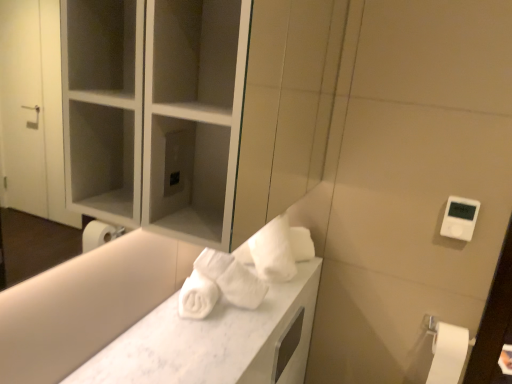
What is the approximate width of white matte toilet paper at lower right?

5.99 inches.

This screenshot has height=384, width=512. Find the location of `white matte toilet paper at lower right`. white matte toilet paper at lower right is located at coordinates (448, 354).

Describe the element at coordinates (448, 354) in the screenshot. This screenshot has width=512, height=384. I see `white matte toilet paper at lower right` at that location.

What do you see at coordinates (216, 341) in the screenshot?
I see `white marble counter top at center` at bounding box center [216, 341].

Image resolution: width=512 pixels, height=384 pixels. Identify the location of white marble counter top at center. (216, 341).

This screenshot has height=384, width=512. I want to click on white matte toilet paper at lower right, so click(448, 354).

Considering the positions of objects white matte toilet paper at lower right and white marble counter top at center in the image provided, who is more to the left, white matte toilet paper at lower right or white marble counter top at center?

white marble counter top at center is more to the left.

Which object is further away from the camera, white matte toilet paper at lower right or white marble counter top at center?

Positioned behind is white matte toilet paper at lower right.

Between point (449, 380) and point (238, 324), which one is positioned in front?

Positioned in front is point (238, 324).

From the picture: From the image's perspective, is white matte toilet paper at lower right above or below white marble counter top at center?

Clearly, from the image's perspective, white matte toilet paper at lower right is below white marble counter top at center.

From a real-world perspective, is white matte toilet paper at lower right over white marble counter top at center?

No, from a real-world perspective, white matte toilet paper at lower right is not over white marble counter top at center

Is white matte toilet paper at lower right wider than white marble counter top at center?

No, white matte toilet paper at lower right is not wider than white marble counter top at center.

From their relative heights in the image, would you say white matte toilet paper at lower right is taller or shorter than white marble counter top at center?

Considering their sizes, white matte toilet paper at lower right has more height than white marble counter top at center.

Considering the sizes of objects white matte toilet paper at lower right and white marble counter top at center in the image provided, who is smaller, white matte toilet paper at lower right or white marble counter top at center?

Smaller between the two is white matte toilet paper at lower right.

Would you say white matte toilet paper at lower right contains white marble counter top at center?

No.

Is white matte toilet paper at lower right far from white marble counter top at center?

No, there isn't a large distance between white matte toilet paper at lower right and white marble counter top at center.

Does white matte toilet paper at lower right turn towards white marble counter top at center?

No.

Can you tell me how much white matte toilet paper at lower right and white marble counter top at center differ in facing direction?

They differ by 89.4 degrees in their facing directions.

Measure the distance between white matte toilet paper at lower right and white marble counter top at center.

white matte toilet paper at lower right is 62.23 centimeters from white marble counter top at center.

Locate an element on the screen. toilet paper behind the white marble counter top at center is located at coordinates (448, 354).

Which object is positioned more to the right, white marble counter top at center or white matte toilet paper at lower right?

white matte toilet paper at lower right is more to the right.

Which is in front, white marble counter top at center or white matte toilet paper at lower right?

white marble counter top at center is more forward.

Is point (275, 335) closer or farther from the camera than point (435, 346)?

Point (275, 335) appears to be closer to the viewer than point (435, 346).

From the image's perspective, is white marble counter top at center below white matte toilet paper at lower right?

Incorrect, from the image's perspective, white marble counter top at center is higher than white matte toilet paper at lower right.

From a real-world perspective, which is physically below, white marble counter top at center or white matte toilet paper at lower right?

white matte toilet paper at lower right, from a real-world perspective.

Considering the relative sizes of white marble counter top at center and white matte toilet paper at lower right in the image provided, is white marble counter top at center wider than white matte toilet paper at lower right?

Yes, white marble counter top at center is wider than white matte toilet paper at lower right.

Between white marble counter top at center and white matte toilet paper at lower right, which one has less height?

With less height is white marble counter top at center.

Considering the sizes of white marble counter top at center and white matte toilet paper at lower right in the image, is white marble counter top at center bigger or smaller than white matte toilet paper at lower right?

white marble counter top at center is bigger than white matte toilet paper at lower right.

Is white marble counter top at center not within white matte toilet paper at lower right?

Yes, white marble counter top at center is outside of white matte toilet paper at lower right.

Is white marble counter top at center next to white matte toilet paper at lower right and touching it?

They are not placed beside each other.

Could you tell me if white marble counter top at center is turned towards white matte toilet paper at lower right?

No, white marble counter top at center is not aimed at white matte toilet paper at lower right.

Measure the distance from white marble counter top at center to white matte toilet paper at lower right.

24.50 inches.

There is a white matte toilet paper at lower right. Identify the location of counter top above it (from a real-world perspective). (216, 341).

You are a GUI agent. You are given a task and a screenshot of the screen. Output one action in this format:
    pyautogui.click(x=<x>, y=<y>)
    Task: Click on the toilet paper behind the white marble counter top at center
    
    Given the screenshot: What is the action you would take?
    pyautogui.click(x=448, y=354)

The height and width of the screenshot is (384, 512). Find the location of `counter top in front of the white matte toilet paper at lower right`. counter top in front of the white matte toilet paper at lower right is located at coordinates (216, 341).